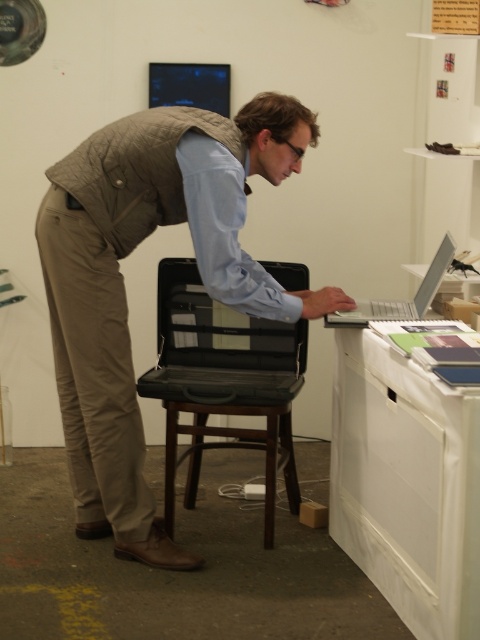
You are standing in the room and want to place a new item on the white glossy table at lower right. Can you easily access it from your current position in front of the light brown quilted vest at center?

The white glossy table at lower right is behind the light brown quilted vest at center, so you would need to move around or behind the vest to access it, making it difficult to reach easily from your current position.

You are standing in front of the desk and need to place a small item on the wooden stool at center. Can you place it directly on top of the light blue cotton dress shirt at center?

The light blue cotton dress shirt at center is located above the wooden stool at center, so you cannot place the item on the stool directly under the shirt since the shirt is already above it.

You are a fashion designer observing the scene. You need to decide which item is taller between the light brown quilted vest at center and the white glossy table at lower right. Which one is taller?

The light brown quilted vest at center is taller than the white glossy table at lower right according to the description.